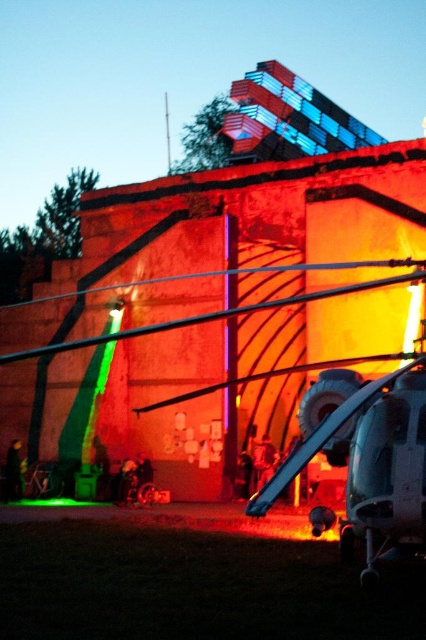
Question: In this image, where is dark green fabric jacket at lower left located relative to smooth skin person at center?

Choices:
 (A) left
 (B) right

Answer: (A)

Question: Does dark green fabric jacket at lower left appear under smooth skin person at center?

Choices:
 (A) no
 (B) yes

Answer: (B)

Question: Among these points, which one is nearest to the camera?

Choices:
 (A) (17, 477)
 (B) (271, 467)

Answer: (B)

Question: Which point is farther to the camera?

Choices:
 (A) smooth skin person at center
 (B) dark green fabric jacket at lower left

Answer: (B)

Question: Can you confirm if dark green fabric jacket at lower left is wider than smooth skin person at center?

Choices:
 (A) no
 (B) yes

Answer: (B)